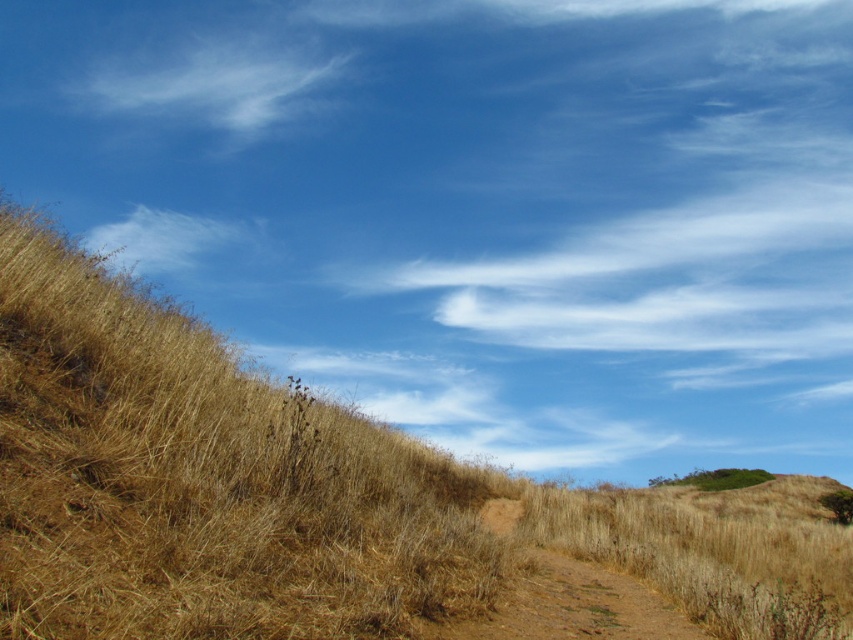
Looking at this image, you are an artist trying to paint the landscape. You notice the dry grass at upper left and the white cotton cloud at upper center. Which one should you depict as shorter in your painting?

The dry grass at upper left should be depicted as shorter because it has a lesser height compared to the white cotton cloud at upper center.

Looking at this image, you are standing at the point marked as point (x=202, y=477) in the image. What type of terrain are you currently on?

You are currently on dry grass at upper left, as point (x=202, y=477) corresponds to dry grass at upper left.